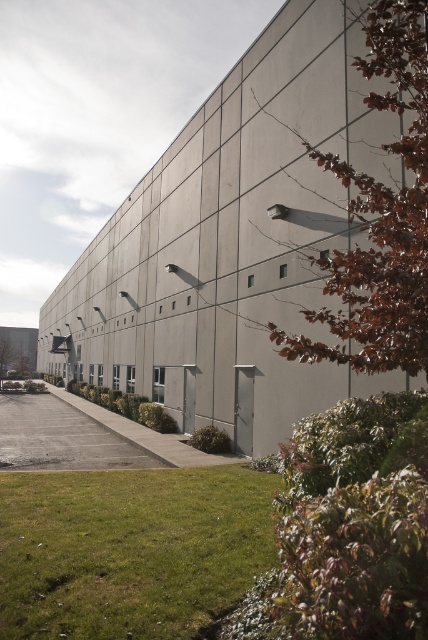
Does gray concrete building at center have a greater height compared to green grass at lower left?

Indeed, gray concrete building at center has a greater height compared to green grass at lower left.

Who is shorter, gray concrete building at center or green grass at lower left?

green grass at lower left is shorter.

This screenshot has height=640, width=428. Find the location of `gray concrete building at center`. gray concrete building at center is located at coordinates click(x=232, y=243).

I want to click on gray concrete building at center, so click(232, 243).